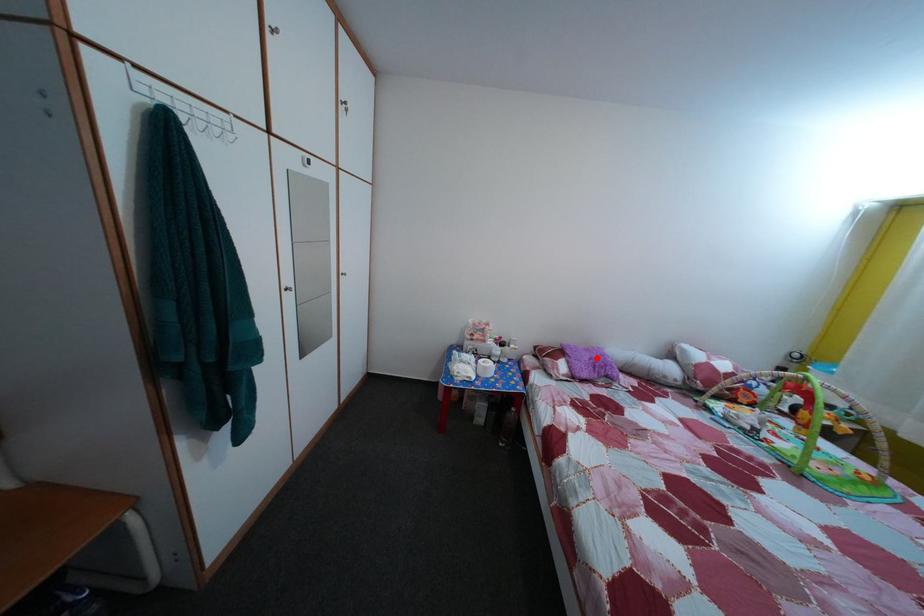
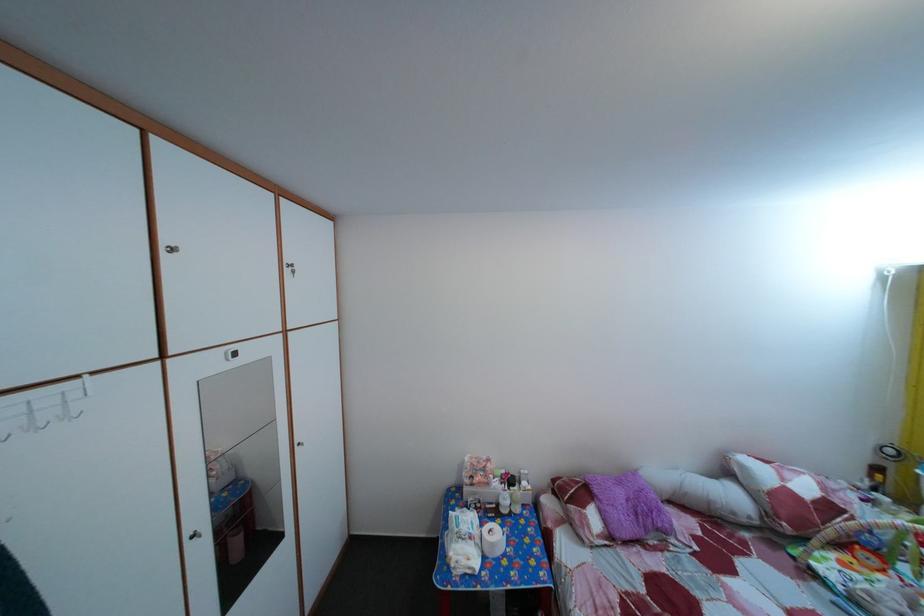
In the second image, find the point that corresponds to the highlighted location in the first image.

(629, 491)